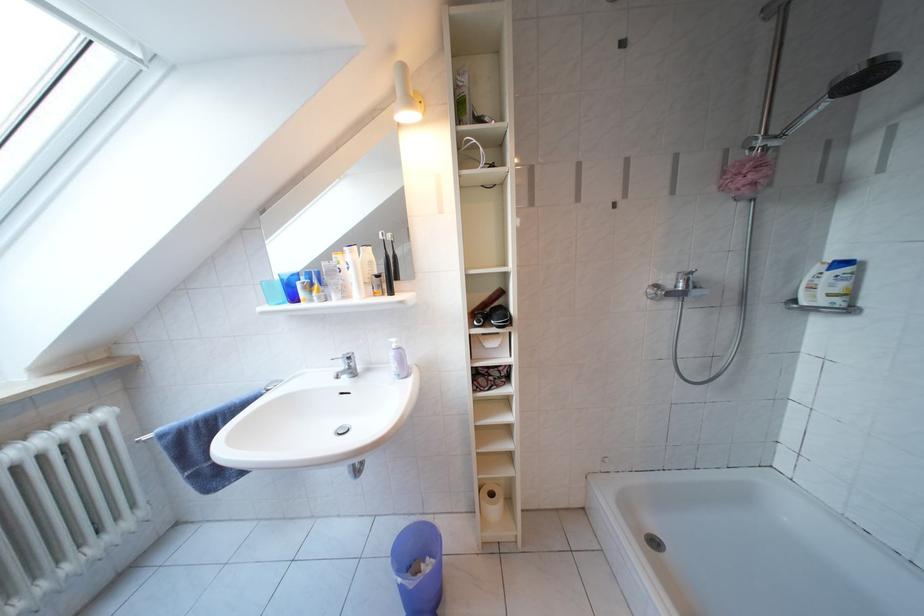
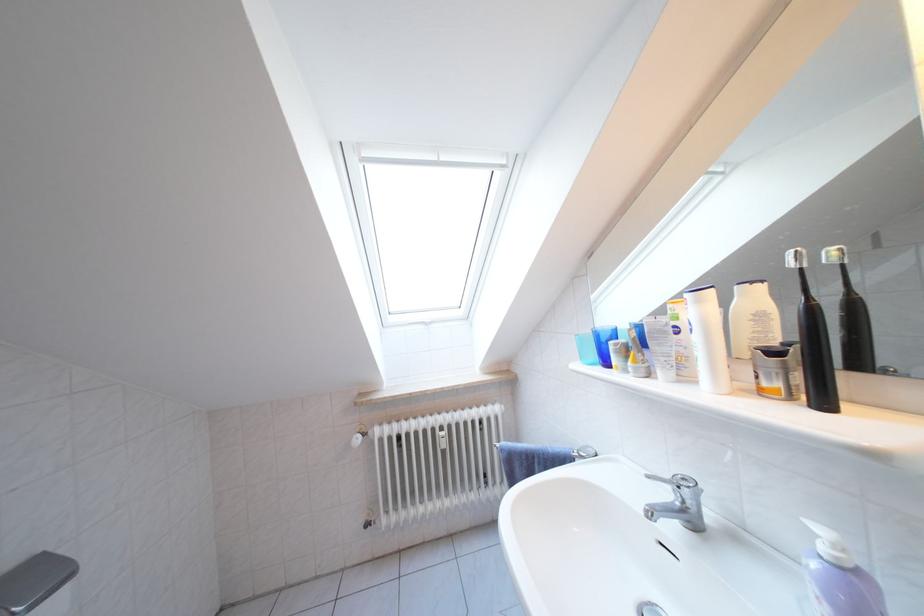
The point at (x=399, y=297) is marked in the first image. Where is the corresponding point in the second image?

(833, 407)